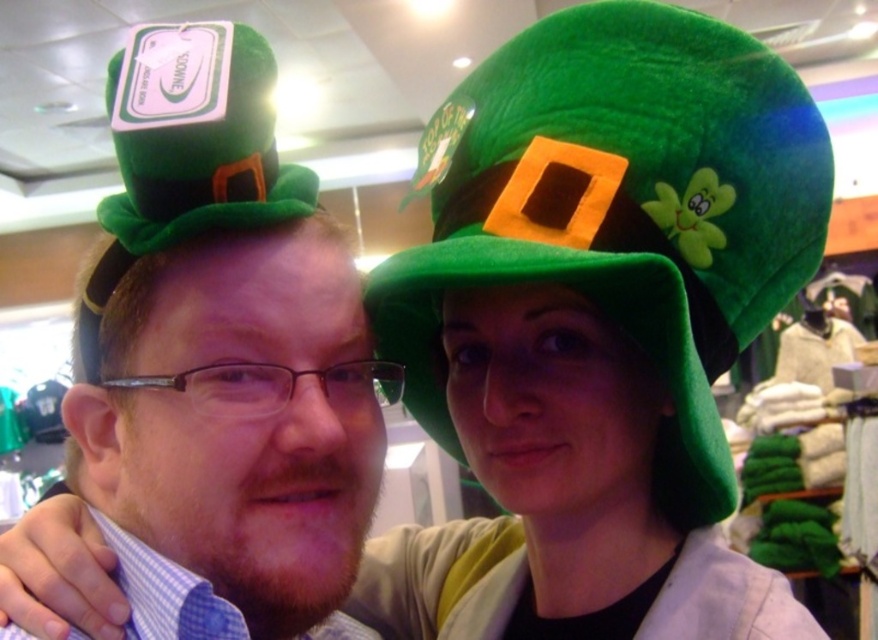
Who is taller, velvety green hat at upper right or matte green hat at left?

With more height is velvety green hat at upper right.

Is point (796, 134) positioned before point (137, 477)?

No, it is behind (137, 477).

Identify the location of velvety green hat at upper right. This screenshot has height=640, width=878. (621, 209).

Is velvety green hat at upper right wider than green plush hat at upper left?

Correct, the width of velvety green hat at upper right exceeds that of green plush hat at upper left.

Which is in front, point (445, 282) or point (207, 52)?

Point (207, 52) is more forward.

The width and height of the screenshot is (878, 640). Identify the location of velvety green hat at upper right. (621, 209).

Which of these two, matte green hat at left or green plush hat at upper left, stands taller?

matte green hat at left is taller.

From the picture: Is matte green hat at left to the right of green plush hat at upper left from the viewer's perspective?

Indeed, matte green hat at left is positioned on the right side of green plush hat at upper left.

Is point (103, 467) closer to camera compared to point (137, 90)?

No, it is behind (137, 90).

This screenshot has width=878, height=640. I want to click on matte green hat at left, so 242,419.